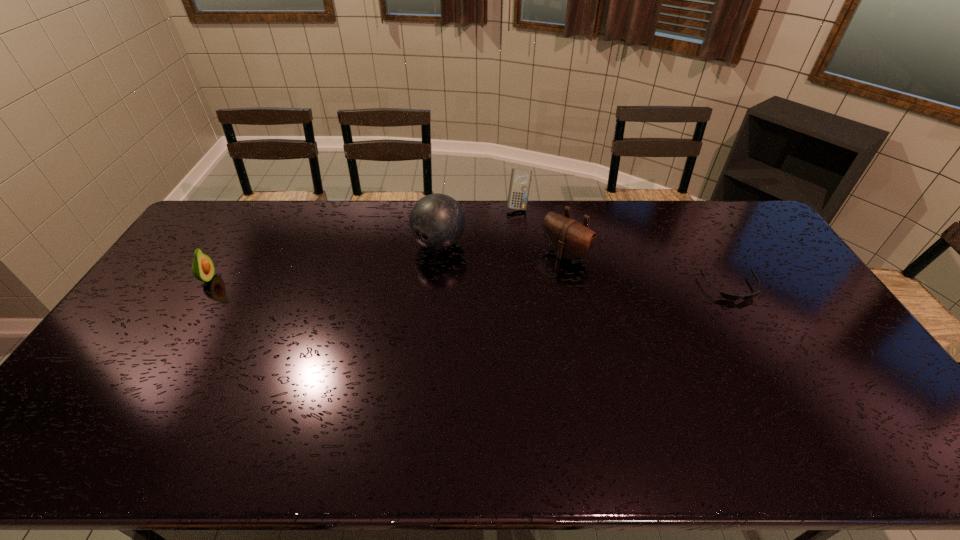
Where is `avocado`? The image size is (960, 540). avocado is located at coordinates (203, 269).

I want to click on the second shortest object, so click(x=203, y=269).

In order to click on sunglasses in this screenshot , I will do pyautogui.click(x=730, y=297).

Identify the location of the shortest object. This screenshot has height=540, width=960. (730, 297).

Where is `bowling ball`? bowling ball is located at coordinates (437, 221).

I want to click on the tallest object, so click(x=437, y=221).

You are a GUI agent. You are given a task and a screenshot of the screen. Output one action in this format:
    pyautogui.click(x=<x>, y=<y>)
    Task: Click on the farthest object
    
    Given the screenshot: What is the action you would take?
    pyautogui.click(x=520, y=180)

Locate an element on the screen. This screenshot has height=540, width=960. calculator is located at coordinates (520, 180).

Find the location of a particular element. The image size is (960, 540). pouch is located at coordinates (568, 238).

At what (x,y) coordinates should I click in order to perform the action: click on vacant region located 0.080m on the cut side of the leftmost object. Please return your answer as a coordinate pair (x, y). The width and height of the screenshot is (960, 540). Looking at the image, I should click on (241, 279).